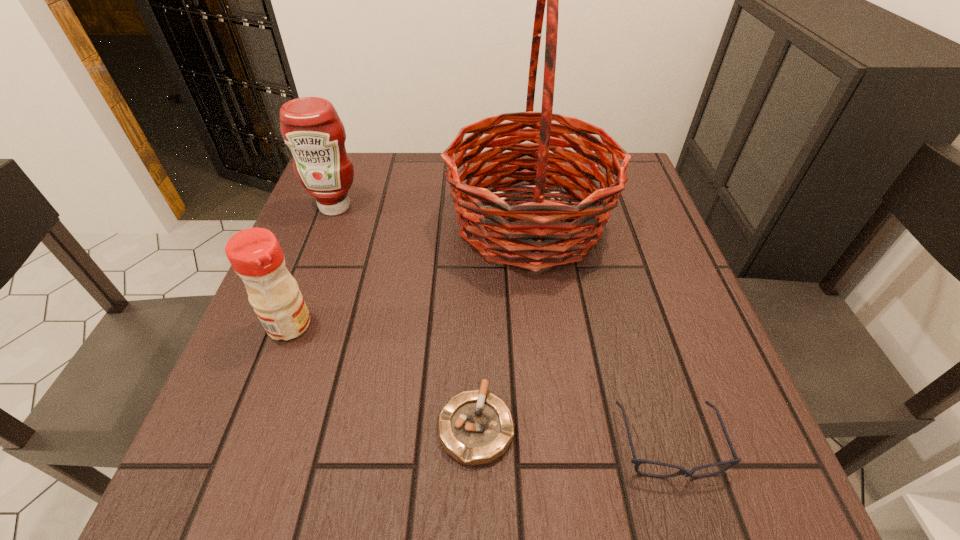
The image size is (960, 540). Find the location of `basket`. basket is located at coordinates (518, 235).

I want to click on the farther condiment, so click(x=310, y=126).

The height and width of the screenshot is (540, 960). In order to click on the taller condiment in this screenshot , I will do `click(310, 126)`.

What are the coordinates of `the third nearest object` in the screenshot? It's located at (255, 254).

Where is `the shorter condiment`? This screenshot has height=540, width=960. the shorter condiment is located at coordinates (255, 254).

Identify the location of the second shortest object. This screenshot has width=960, height=540. (682, 471).

Image resolution: width=960 pixels, height=540 pixels. I want to click on ashtray, so click(x=475, y=427).

I want to click on vacant space located on the handle side of the tallest object, so click(420, 223).

I want to click on vacant area situated on the handle side of the tallest object, so click(x=403, y=223).

You are a GUI agent. You are given a task and a screenshot of the screen. Output one action in this format:
    pyautogui.click(x=<x>, y=<y>)
    Task: Click on the free space located on the handle side of the tallest object
    
    Given the screenshot: What is the action you would take?
    pyautogui.click(x=357, y=223)